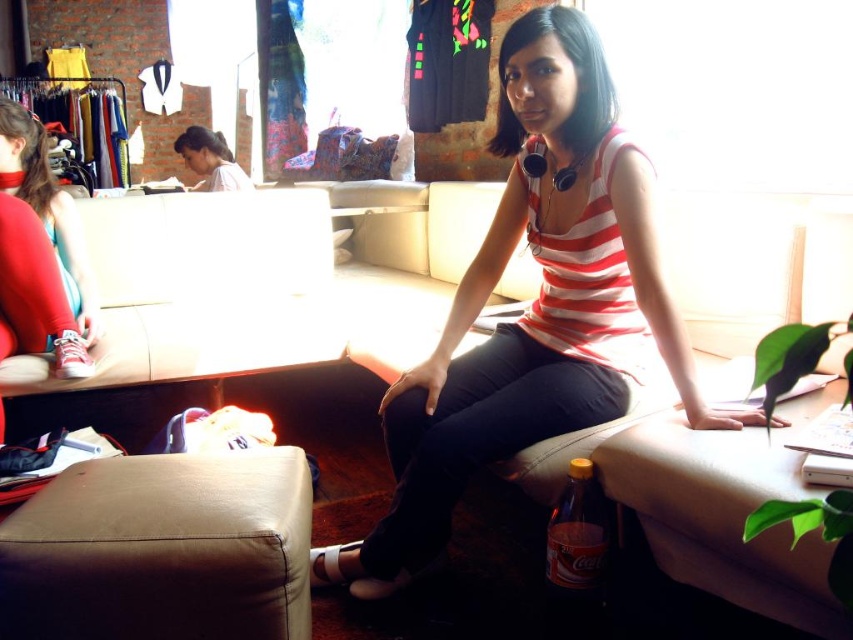
Looking at this image, does beige leather couch at lower left have a smaller size compared to matte red sneakers at lower left?

No, beige leather couch at lower left is not smaller than matte red sneakers at lower left.

Does beige leather couch at lower left appear on the left side of matte red sneakers at lower left?

Incorrect, beige leather couch at lower left is not on the left side of matte red sneakers at lower left.

Between point (183, 241) and point (13, 147), which one is positioned behind?

Positioned behind is point (183, 241).

Find the location of a particular element. Image resolution: width=853 pixels, height=640 pixels. beige leather couch at lower left is located at coordinates (202, 288).

Who is positioned more to the left, striped fabric top at center or beige leather couch at lower left?

From the viewer's perspective, beige leather couch at lower left appears more on the left side.

Which is behind, point (509, 236) or point (128, 358)?

Positioned behind is point (128, 358).

At what (x,y) coordinates should I click in order to perform the action: click on striped fabric top at center. Please return your answer as a coordinate pair (x, y). The height and width of the screenshot is (640, 853). Looking at the image, I should click on (532, 307).

Image resolution: width=853 pixels, height=640 pixels. Describe the element at coordinates (161, 550) in the screenshot. I see `leather ottoman at lower left` at that location.

Which of these two, leather ottoman at lower left or dark brown hair at upper left, stands taller?

Standing taller between the two is dark brown hair at upper left.

Where is `leather ottoman at lower left`? leather ottoman at lower left is located at coordinates (161, 550).

Find the location of a particular element. This screenshot has width=853, height=640. leather ottoman at lower left is located at coordinates (161, 550).